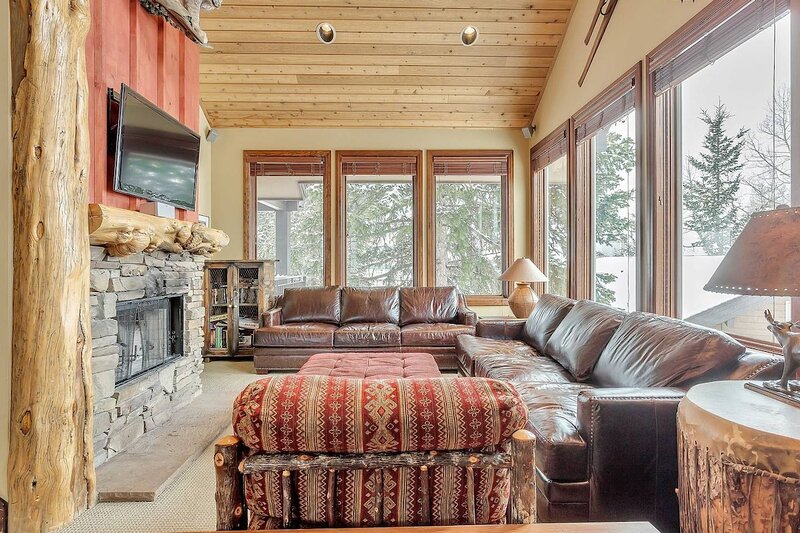
This screenshot has height=533, width=800. I want to click on lamp, so click(762, 290).